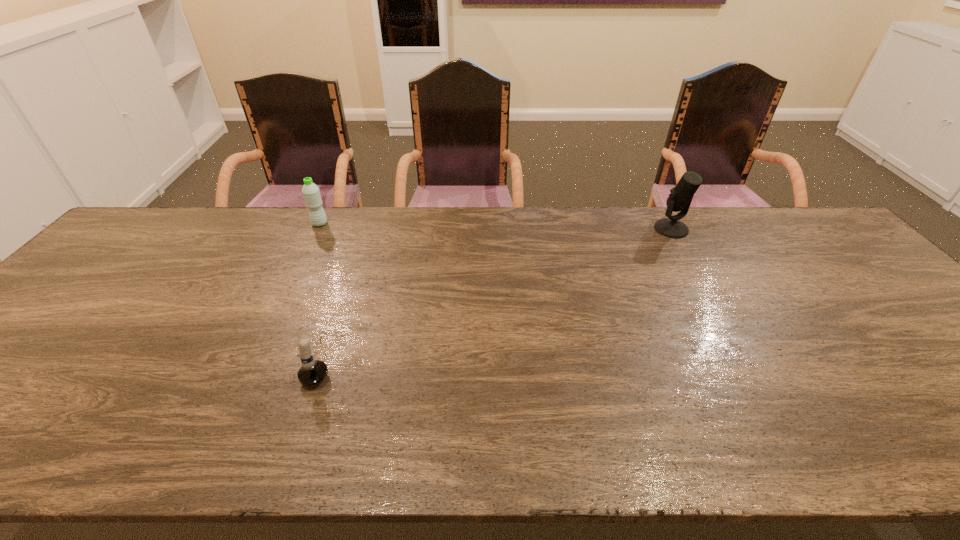
Image resolution: width=960 pixels, height=540 pixels. I want to click on free spot between the second shortest object and the farther microphone, so click(495, 226).

Locate an element on the screen. The image size is (960, 540). free space between the leftmost object and the tallest object is located at coordinates (495, 226).

You are a GUI agent. You are given a task and a screenshot of the screen. Output one action in this format:
    pyautogui.click(x=<x>, y=<y>)
    Task: Click on the vacant region between the tallest object and the nearer microphone
    The height and width of the screenshot is (540, 960).
    Given the screenshot: What is the action you would take?
    pyautogui.click(x=496, y=295)

Find the location of a particular element. vacant area that lies between the left microphone and the water bottle is located at coordinates (320, 293).

Where is `free spot between the farther microphone and the leftmost object`? The width and height of the screenshot is (960, 540). free spot between the farther microphone and the leftmost object is located at coordinates (495, 226).

This screenshot has height=540, width=960. Identify the location of vacant area that lies between the leftmost object and the second object from right to left. (320, 293).

Locate which object ranks in proximity to the second object from left to right. Please provide its 2D coordinates. Your answer should be formatted as a tuple, i.e. [(x, y)], where the tuple contains the x and y coordinates of a point satisfying the conditions above.

[(312, 197)]

Locate which object is the second closest to the second object from right to left. Please provide its 2D coordinates. Your answer should be formatted as a tuple, i.e. [(x, y)], where the tuple contains the x and y coordinates of a point satisfying the conditions above.

[(681, 196)]

At what (x,y) coordinates should I click in order to perform the action: click on vacant point that satisfies the following two spatial constraints: 1. on the front side of the leftmost object; 2. on the right side of the second object from right to left. Please return your answer as a coordinate pair (x, y). This screenshot has width=960, height=540. Looking at the image, I should click on (253, 362).